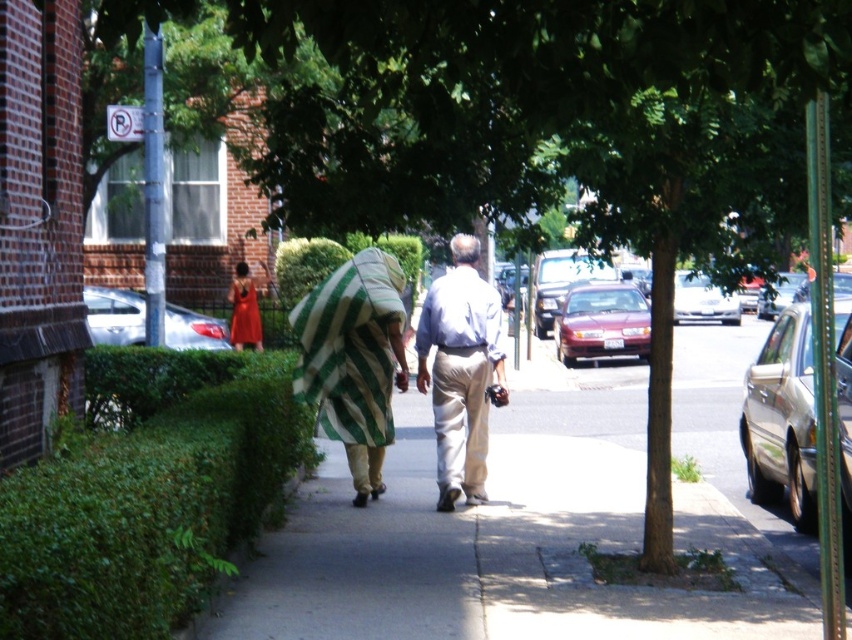
In the scene shown: Which is below, green striped blanket at center or silver metallic sedan at left?

Positioned lower is green striped blanket at center.

Does point (321, 403) lie behind point (108, 301)?

No, it is not.

Where is `green striped blanket at center`? Image resolution: width=852 pixels, height=640 pixels. green striped blanket at center is located at coordinates (350, 348).

Does light blue shirt at center have a smaller size compared to gold metallic sedan at right?

Indeed, light blue shirt at center has a smaller size compared to gold metallic sedan at right.

This screenshot has width=852, height=640. What do you see at coordinates (461, 371) in the screenshot?
I see `light blue shirt at center` at bounding box center [461, 371].

Between point (494, 296) and point (806, 410), which one is positioned behind?

Positioned behind is point (494, 296).

The image size is (852, 640). What are the coordinates of `light blue shirt at center` in the screenshot? It's located at (461, 371).

Who is more forward, (x=347, y=330) or (x=258, y=330)?

Positioned in front is point (x=347, y=330).

Which is in front, point (399, 269) or point (232, 301)?

Positioned in front is point (399, 269).

Where is `green striped blanket at center`? The image size is (852, 640). green striped blanket at center is located at coordinates (350, 348).